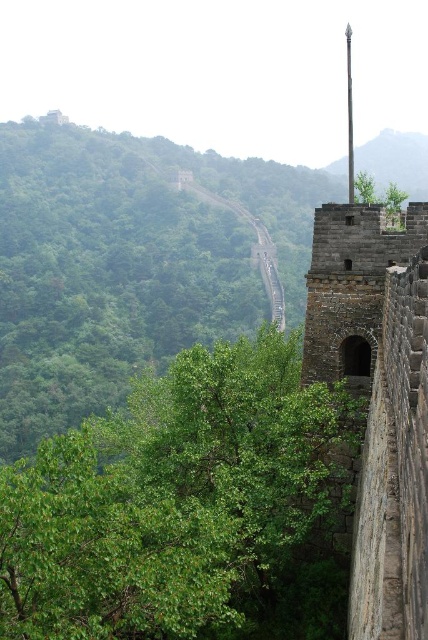
Question: Which of the following is the closest to the observer?

Choices:
 (A) green stone wall at upper center
 (B) green leafy tree at upper center
 (C) green leafy tree at center-left

Answer: (C)

Question: Among these objects, which one is farthest from the camera?

Choices:
 (A) green stone wall at upper center
 (B) green leafy tree at center-left
 (C) green leafy tree at upper center

Answer: (A)

Question: Which object appears farthest from the camera in this image?

Choices:
 (A) green stone wall at upper center
 (B) green leafy tree at center-left
 (C) green leafy tree at upper center

Answer: (A)

Question: Observing the image, what is the correct spatial positioning of green leafy tree at center-left in reference to green stone wall at upper center?

Choices:
 (A) left
 (B) right

Answer: (A)

Question: Does green stone wall at upper center have a greater width compared to green leafy tree at upper center?

Choices:
 (A) yes
 (B) no

Answer: (A)

Question: Can you confirm if green leafy tree at center-left is bigger than green stone wall at upper center?

Choices:
 (A) yes
 (B) no

Answer: (B)